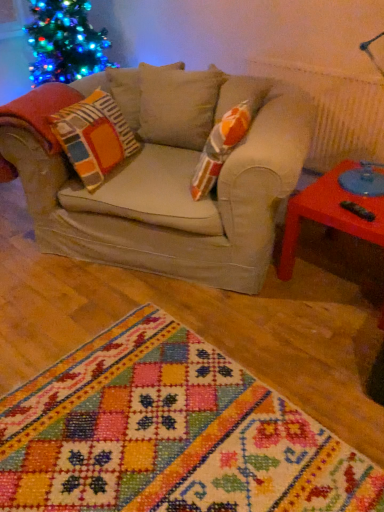
Describe the element at coordinates (169, 434) in the screenshot. I see `multicolored woven rug at center` at that location.

The height and width of the screenshot is (512, 384). Find the location of `multicolored woven rug at center`. multicolored woven rug at center is located at coordinates (169, 434).

This screenshot has height=512, width=384. What do you see at coordinates (329, 215) in the screenshot?
I see `rubberized plastic table at right` at bounding box center [329, 215].

Find the location of a particular element. rubberized plastic table at right is located at coordinates (329, 215).

At what (x,y) coordinates should I click in order to perform the action: click on multicolored woven rug at center. Please return your answer as a coordinate pair (x, y). This screenshot has width=384, height=512. Looking at the image, I should click on (169, 434).

Is multicolored woven rug at center at the left side of rubberized plastic table at right?

Correct, you'll find multicolored woven rug at center to the left of rubberized plastic table at right.

Between multicolored woven rug at center and rubberized plastic table at right, which one is positioned behind?

rubberized plastic table at right is further from the camera.

Considering the points (113, 445) and (285, 249), which point is in front, point (113, 445) or point (285, 249)?

The point (113, 445) is more forward.

From the image's perspective, is multicolored woven rug at center over rubberized plastic table at right?

No, from the image's perspective, multicolored woven rug at center is not over rubberized plastic table at right.

From a real-world perspective, is multicolored woven rug at center on rubberized plastic table at right?

No, from a real-world perspective, multicolored woven rug at center is not on top of rubberized plastic table at right.

Which object is wider, multicolored woven rug at center or rubberized plastic table at right?

multicolored woven rug at center.

Considering the sizes of objects multicolored woven rug at center and rubberized plastic table at right in the image provided, who is shorter, multicolored woven rug at center or rubberized plastic table at right?

With less height is multicolored woven rug at center.

Looking at the image, does multicolored woven rug at center seem bigger or smaller compared to rubberized plastic table at right?

multicolored woven rug at center is bigger than rubberized plastic table at right.

From the picture: Is multicolored woven rug at center not within rubberized plastic table at right?

Yes.

Is multicolored woven rug at center beside rubberized plastic table at right?

No.

Is multicolored woven rug at center facing towards rubberized plastic table at right?

No.

Measure the distance from multicolored woven rug at center to rubberized plastic table at right.

multicolored woven rug at center is 36.06 inches away from rubberized plastic table at right.

Locate an element on the screen. Image resolution: width=384 pixels, height=512 pixels. blanket below the rubberized plastic table at right (from the image's perspective) is located at coordinates (169, 434).

Which object is positioned more to the right, rubberized plastic table at right or multicolored woven rug at center?

Positioned to the right is rubberized plastic table at right.

Considering their positions, is rubberized plastic table at right located in front of or behind multicolored woven rug at center?

Clearly, rubberized plastic table at right is behind multicolored woven rug at center.

Does point (282, 263) appear closer or farther from the camera than point (345, 466)?

Point (282, 263) is positioned farther from the camera compared to point (345, 466).

From the image's perspective, which one is positioned higher, rubberized plastic table at right or multicolored woven rug at center?

rubberized plastic table at right, from the image's perspective.

From a real-world perspective, between rubberized plastic table at right and multicolored woven rug at center, who is vertically lower?

multicolored woven rug at center, from a real-world perspective.

From the picture: Between rubberized plastic table at right and multicolored woven rug at center, which one has larger width?

Wider between the two is multicolored woven rug at center.

In terms of height, does rubberized plastic table at right look taller or shorter compared to multicolored woven rug at center?

In the image, rubberized plastic table at right appears to be taller than multicolored woven rug at center.

Looking at the image, does rubberized plastic table at right seem bigger or smaller compared to multicolored woven rug at center?

Considering their sizes, rubberized plastic table at right takes up less space than multicolored woven rug at center.

Is rubberized plastic table at right not inside multicolored woven rug at center?

Yes, rubberized plastic table at right is outside of multicolored woven rug at center.

Are rubberized plastic table at right and multicolored woven rug at center far apart?

No, rubberized plastic table at right is not far away from multicolored woven rug at center.

Is rubberized plastic table at right oriented towards multicolored woven rug at center?

No, rubberized plastic table at right is not turned towards multicolored woven rug at center.

How different are the orientations of rubberized plastic table at right and multicolored woven rug at center in degrees?

90 degrees separate the facing orientations of rubberized plastic table at right and multicolored woven rug at center.

How distant is rubberized plastic table at right from multicolored woven rug at center?

36.06 inches.

Image resolution: width=384 pixels, height=512 pixels. I want to click on table on the right side of multicolored woven rug at center, so click(x=329, y=215).

Locate an element on the screen. table that is on the right side of multicolored woven rug at center is located at coordinates (329, 215).

Where is `blanket on the left of rubberized plastic table at right`? blanket on the left of rubberized plastic table at right is located at coordinates (169, 434).